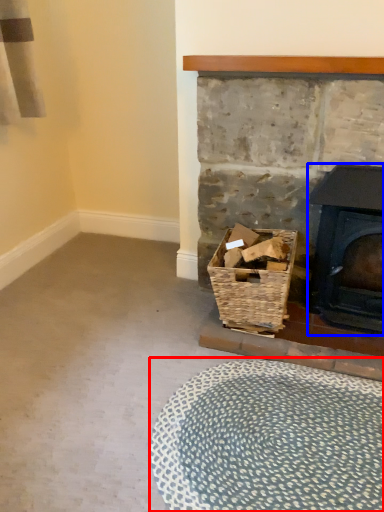
Question: Which point is closer to the camera, plain (highlighted by a red box) or wood burning stove (highlighted by a blue box)?

Choices:
 (A) plain
 (B) wood burning stove

Answer: (A)